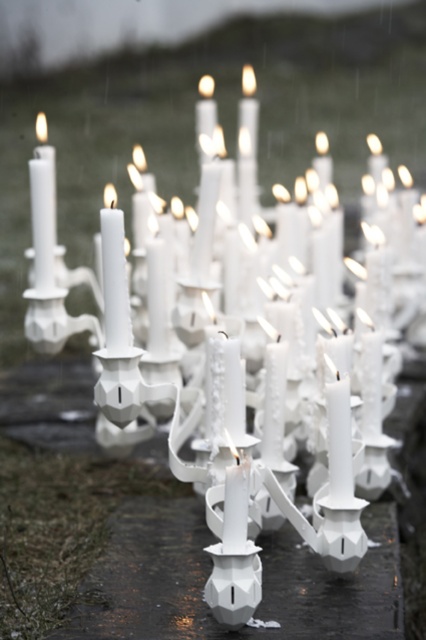
Question: In this image, where is white matte candle at center located relative to white matte candle at left?

Choices:
 (A) below
 (B) above

Answer: (A)

Question: Does white matte candle at center come behind white matte candle at left?

Choices:
 (A) yes
 (B) no

Answer: (B)

Question: Among these objects, which one is farthest from the camera?

Choices:
 (A) white matte candle at left
 (B) white matte candle at center

Answer: (A)

Question: Does white matte candle at center have a larger size compared to white matte candle at left?

Choices:
 (A) yes
 (B) no

Answer: (B)